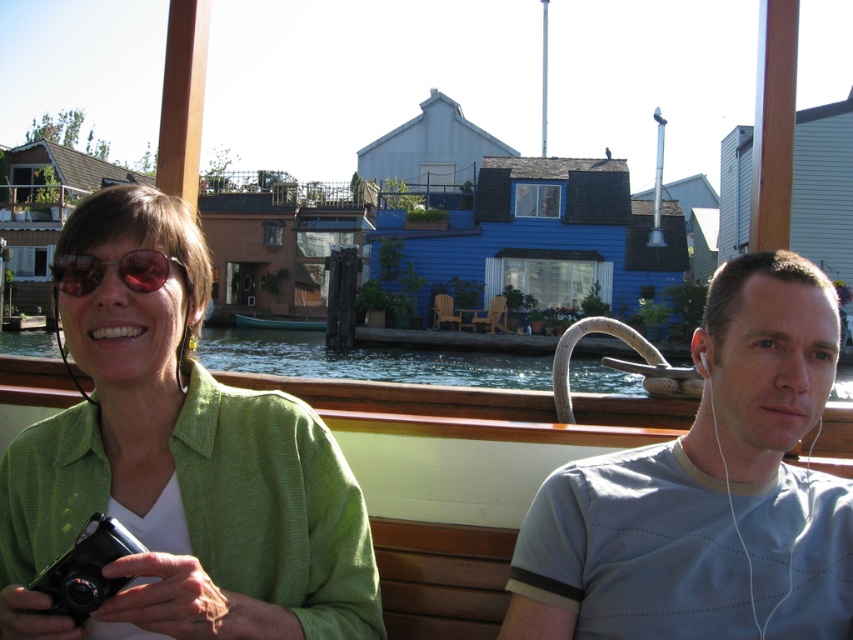
You are designing a poster and need to know the relative sizes of the green textured shirt at left and the clear water at lower center in the image. Which one is wider?

The green textured shirt at left is narrower than the clear water at lower center because its width is less than that of the clear water at lower center.